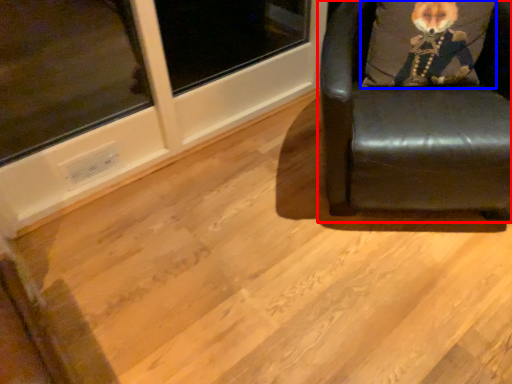
Question: Which object appears farthest to the camera in this image, chair (highlighted by a red box) or throw pillow (highlighted by a blue box)?

Choices:
 (A) chair
 (B) throw pillow

Answer: (B)